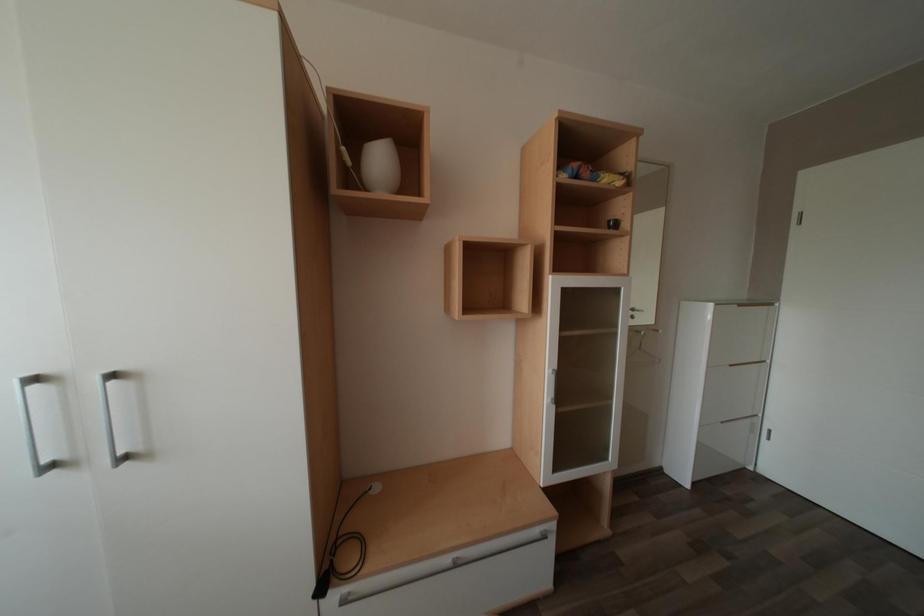
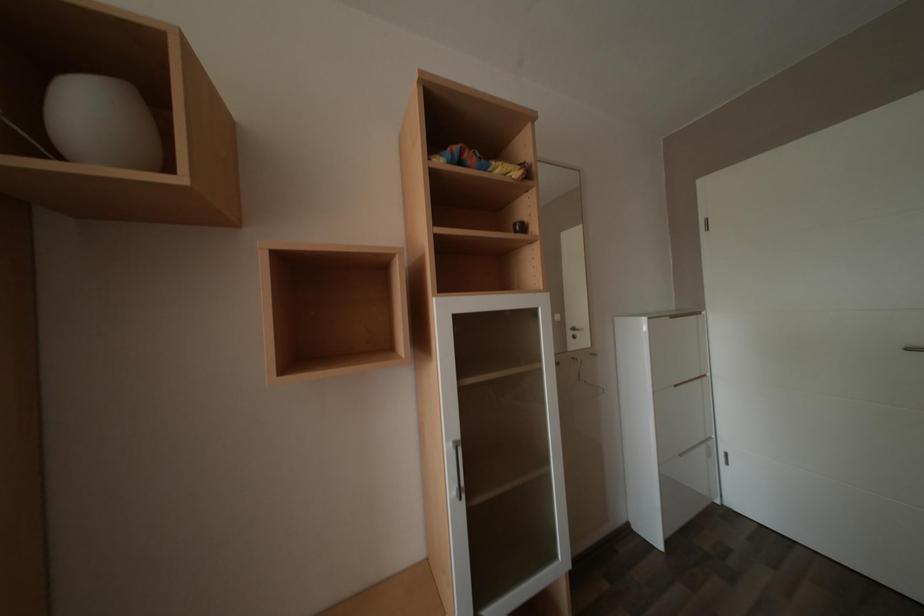
Question: How did the camera likely rotate?

Choices:
 (A) Left
 (B) Right
 (C) Up
 (D) Down

Answer: (B)